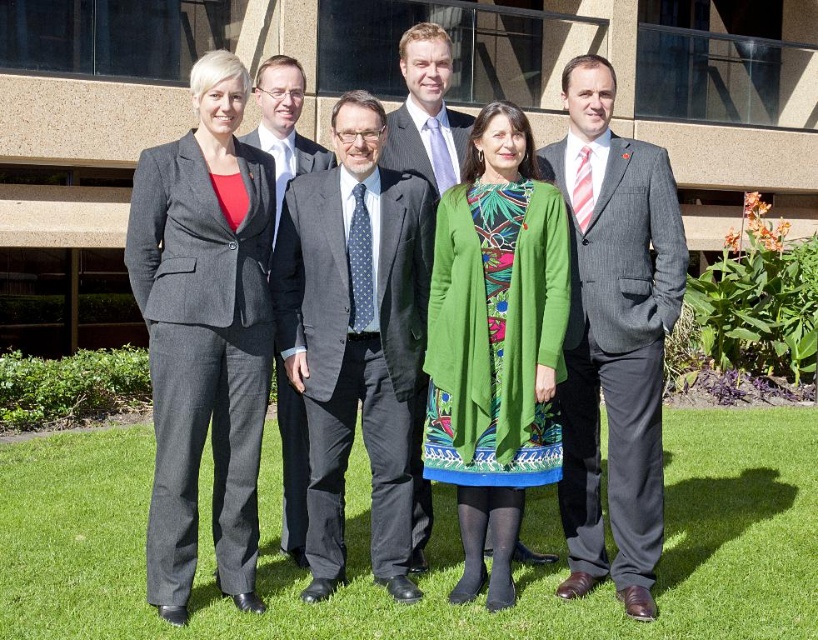
You are a photographer trying to adjust the group photo setup. You notice two key outfits in the image, the dark gray suit at center and the green textured dress at center. Which outfit is positioned to the left of the other?

The dark gray suit at center is positioned on the left side of green textured dress at center, so the dark gray suit at center is to the left of the green textured dress at center.

You are a photographer adjusting your camera settings to focus on the dark gray suit at center and the green textured dress at center. Which one should you focus on first to ensure clarity?

The dark gray suit at center is closer to you than the green textured dress at center, so you should focus on the dark gray suit at center first to ensure clarity.

You are a photographer adjusting the camera focus. You need to ensure both the green textured dress at center and the matte gray suit at center are in focus. Which object should you adjust the focus on first to account for their sizes?

The green textured dress at center is larger than the matte gray suit at center, so you should focus on the green textured dress at center first to ensure its details are captured properly before adjusting for the smaller matte gray suit at center.